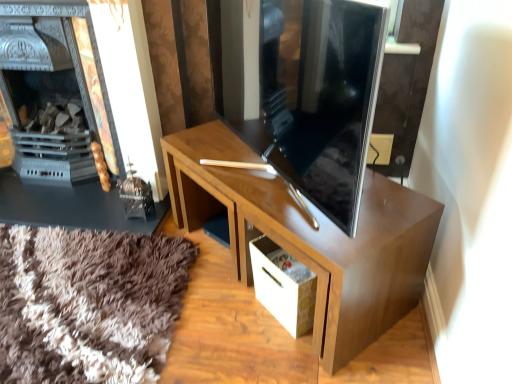
Question: From the image's perspective, is matte black fireplace at left above or below glossy wood desk at center?

Choices:
 (A) below
 (B) above

Answer: (B)

Question: Considering their positions, is matte black fireplace at left located in front of or behind glossy wood desk at center?

Choices:
 (A) front
 (B) behind

Answer: (B)

Question: Based on their relative distances, which object is farther from the glossy wood desk at center?

Choices:
 (A) matte black fireplace at left
 (B) white cardboard drawer at lower center

Answer: (A)

Question: Estimate the real-world distances between objects in this image. Which object is farther from the matte black fireplace at left?

Choices:
 (A) glossy wood desk at center
 (B) white cardboard drawer at lower center

Answer: (B)